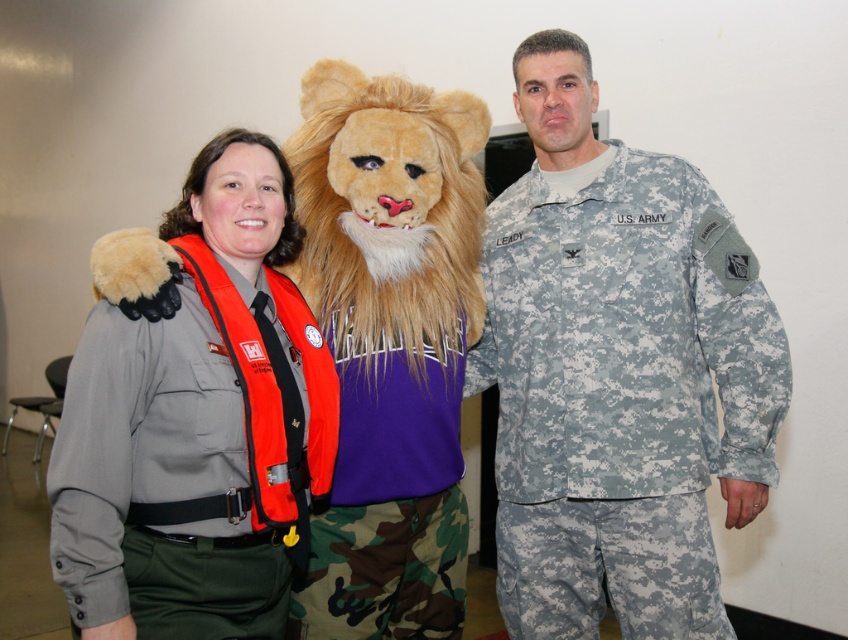
Does camouflage uniform at center appear over gray fabric uniform at center?

Yes.

Is point (668, 349) more distant than point (193, 284)?

Yes, point (668, 349) is behind point (193, 284).

Find the location of a particular element. The height and width of the screenshot is (640, 848). camouflage uniform at center is located at coordinates (618, 372).